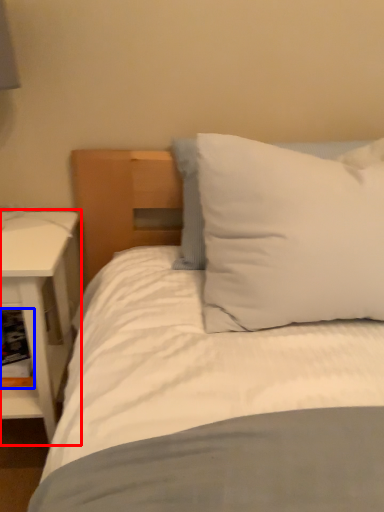
Question: Which of the following is the farthest to the observer, nightstand (highlighted by a red box) or shelf (highlighted by a blue box)?

Choices:
 (A) nightstand
 (B) shelf

Answer: (B)